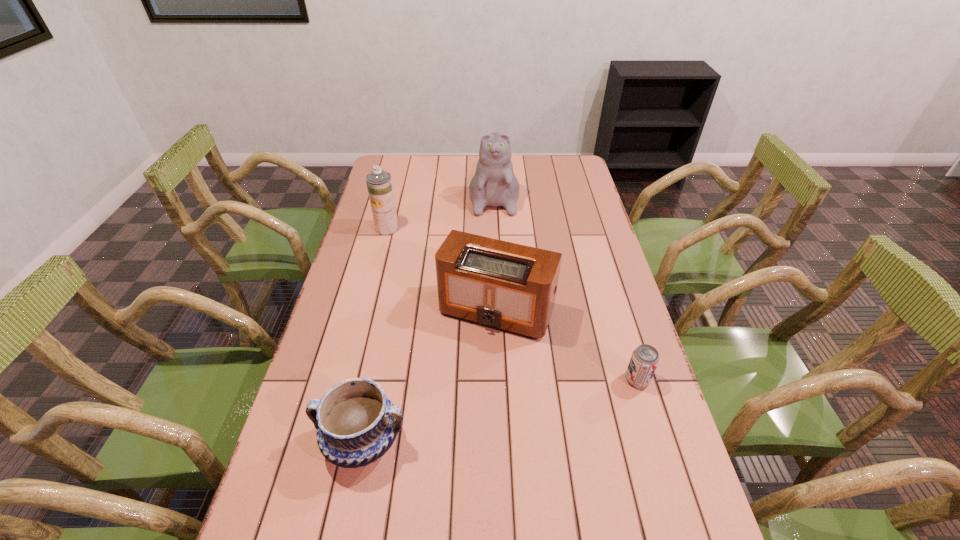
At what (x,y) coordinates should I click in order to perform the action: click on vacant point located on the back of the radio receiver. Please return your answer as a coordinate pair (x, y). Looking at the image, I should click on (494, 238).

Locate an element on the screen. The width and height of the screenshot is (960, 540). vacant position located on the right of the nearest object is located at coordinates (525, 441).

Where is `free location located 0.320m on the left of the second nearest object`? Image resolution: width=960 pixels, height=540 pixels. free location located 0.320m on the left of the second nearest object is located at coordinates (502, 380).

Identify the location of object present at the far edge. (494, 184).

I want to click on aerosol can located in the left edge section of the desktop, so click(x=379, y=183).

Where is `pottery at the left edge`? Image resolution: width=960 pixels, height=540 pixels. pottery at the left edge is located at coordinates (356, 423).

Locate an element on the screen. object located in the right edge section of the desktop is located at coordinates (644, 360).

This screenshot has height=540, width=960. What are the coordinates of `free space at the far edge of the desktop` in the screenshot? It's located at (451, 171).

In the image, there is a desktop. Where is `vacant space at the left edge`? vacant space at the left edge is located at coordinates pyautogui.click(x=368, y=295).

Where is `vacant space at the right edge of the desktop`? This screenshot has width=960, height=540. vacant space at the right edge of the desktop is located at coordinates (610, 302).